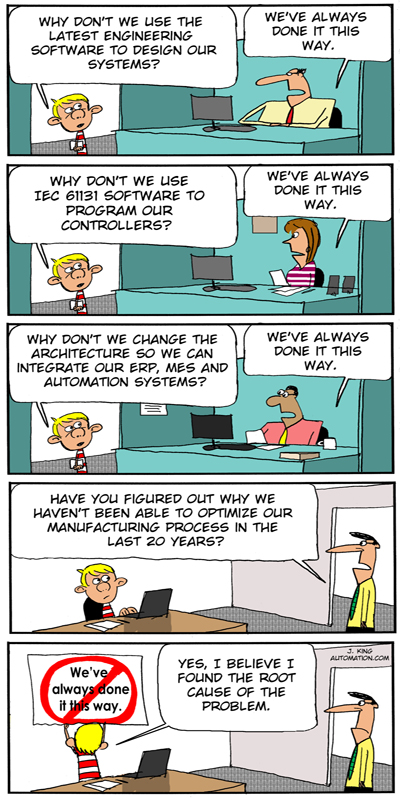
At what (x,y) coordinates should I click in order to perform the action: click on gray carpet. Please return your answer as a coordinate pair (x, y). Looking at the image, I should click on [98, 146], [106, 458], [281, 622], [274, 788].